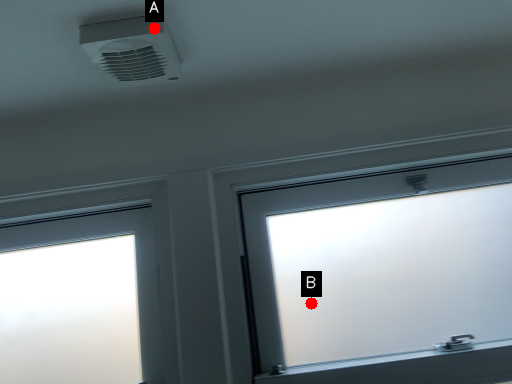
Question: Two points are circled on the image, labeled by A and B beside each circle. Among these points, which one is nearest to the camera?

Choices:
 (A) A is closer
 (B) B is closer

Answer: (A)